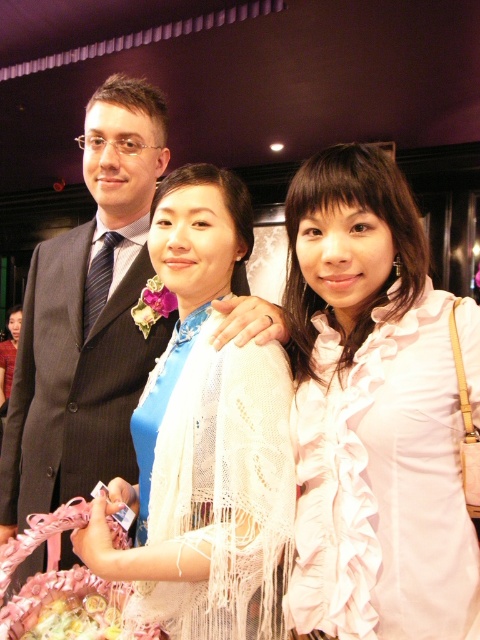
Is point (444, 467) farther from camera compared to point (43, 330)?

No, (444, 467) is in front of (43, 330).

Does white frilly dress at center appear on the right side of dark blue pinstripe suit at center?

Correct, you'll find white frilly dress at center to the right of dark blue pinstripe suit at center.

Is point (309, 500) in front of point (47, 278)?

Yes, it is.

Identify the location of white frilly dress at center. (383, 484).

Consider the image. Does white lace shawl at center have a greater height compared to dark blue pinstripe suit at center?

Incorrect, white lace shawl at center's height is not larger of dark blue pinstripe suit at center's.

Can you confirm if white lace shawl at center is smaller than dark blue pinstripe suit at center?

Yes.

Is point (249, 476) less distant than point (0, 499)?

Yes, it is in front of point (0, 499).

Find the location of a particular element. white lace shawl at center is located at coordinates (222, 486).

This screenshot has height=640, width=480. What are the coordinates of `white frilly dress at center` in the screenshot? It's located at (383, 484).

Does white frilly dress at center appear under white lace shawl at center?

No, white frilly dress at center is not below white lace shawl at center.

Who is more distant from viewer, (434, 330) or (158, 461)?

The point (158, 461) is more distant.

The image size is (480, 640). Identify the location of white frilly dress at center. (383, 484).